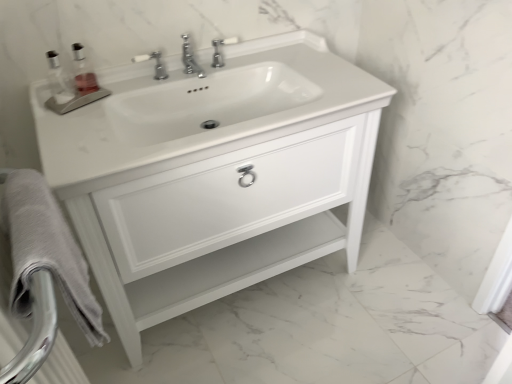
Locate an element on the screen. The height and width of the screenshot is (384, 512). free location in front of clear glass soap dispenser at upper left is located at coordinates (60, 126).